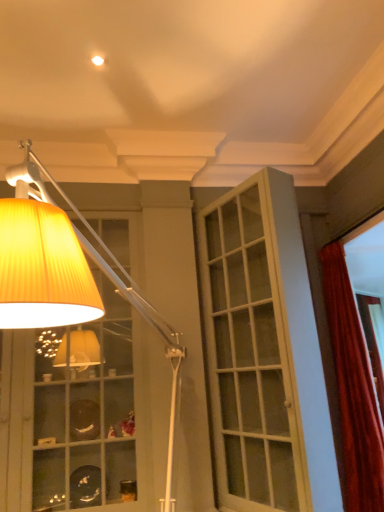
Question: Is point (235, 197) closer or farther from the camera than point (69, 464)?

Choices:
 (A) closer
 (B) farther

Answer: (B)

Question: In terms of width, does white glass door at center look wider or thinner when compared to yellow pleated lampshade at upper left?

Choices:
 (A) wide
 (B) thin

Answer: (B)

Question: Which object is the closest to the velvet red curtain at right?

Choices:
 (A) white glass door at center
 (B) yellow pleated lampshade at upper left

Answer: (A)

Question: Which object is the farthest from the velvet red curtain at right?

Choices:
 (A) white glass door at center
 (B) yellow pleated lampshade at upper left

Answer: (B)